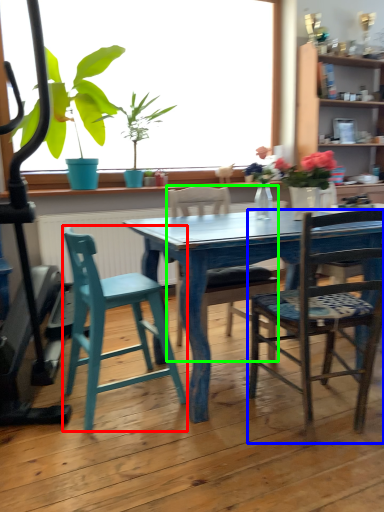
Question: Which is farther away from chair (highlighted by a red box)? chair (highlighted by a blue box) or chair (highlighted by a green box)?

Choices:
 (A) chair
 (B) chair

Answer: (A)